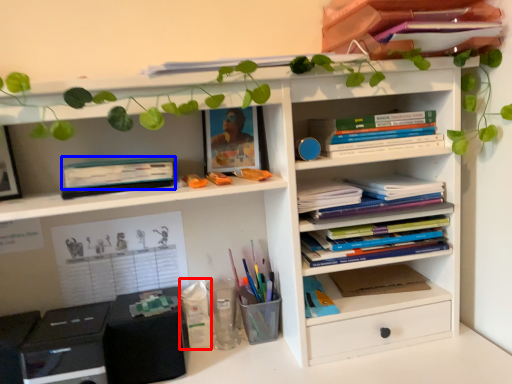
Question: Which object is further to the camera taking this photo, stationery (highlighted by a red box) or paperback book (highlighted by a blue box)?

Choices:
 (A) stationery
 (B) paperback book

Answer: (A)